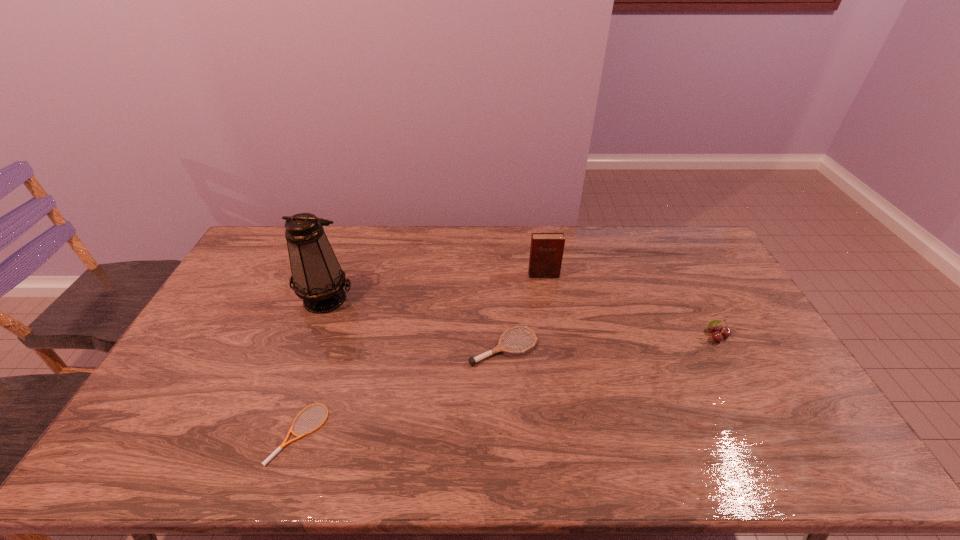
Where is `vacant space located on the right of the oil lamp`? The height and width of the screenshot is (540, 960). vacant space located on the right of the oil lamp is located at coordinates (456, 299).

You are a GUI agent. You are given a task and a screenshot of the screen. Output one action in this format:
    pyautogui.click(x=<x>, y=<y>)
    Task: Click on the free space located on the front cover of the diary
    Image resolution: width=960 pixels, height=540 pixels.
    Given the screenshot: What is the action you would take?
    pyautogui.click(x=553, y=331)

Find the location of a particular element. vacant space located 0.050m on the leaves of the third tallest object is located at coordinates (727, 357).

Where is `vacant area located on the left of the right tennis racket`? The height and width of the screenshot is (540, 960). vacant area located on the left of the right tennis racket is located at coordinates (419, 348).

The height and width of the screenshot is (540, 960). In order to click on vacant space situated on the back of the nearest object in this screenshot , I will do `click(335, 329)`.

At what (x,y) coordinates should I click in order to perform the action: click on object that is at the near edge. Please return your answer as a coordinate pair (x, y). The height and width of the screenshot is (540, 960). Looking at the image, I should click on (284, 443).

This screenshot has width=960, height=540. Identify the location of object at the right edge. (718, 335).

The width and height of the screenshot is (960, 540). I want to click on free space at the far edge of the desktop, so click(449, 250).

The height and width of the screenshot is (540, 960). In the image, there is a desktop. What are the coordinates of `vacant space at the near edge` in the screenshot? It's located at (540, 463).

Image resolution: width=960 pixels, height=540 pixels. In the image, there is a desktop. Identify the location of blank space at the left edge. click(x=244, y=288).